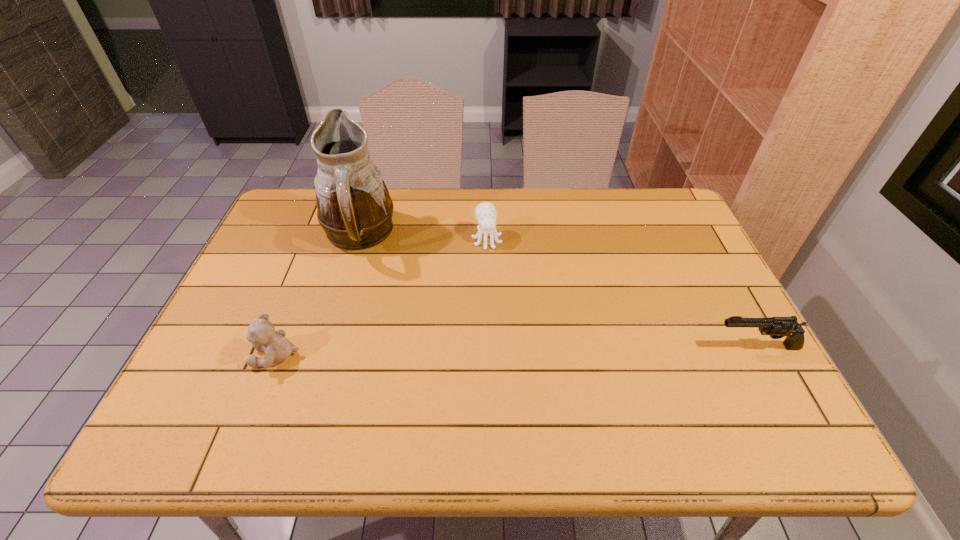
Where is `free space located 0.140m on the front-facing side of the octopus`? This screenshot has height=540, width=960. free space located 0.140m on the front-facing side of the octopus is located at coordinates coord(498,284).

The height and width of the screenshot is (540, 960). In order to click on vacant space situated on the front-facing side of the octopus in this screenshot , I will do `click(492, 262)`.

Find the location of a particular element. The height and width of the screenshot is (540, 960). free space located on the front-facing side of the octopus is located at coordinates (507, 317).

This screenshot has width=960, height=540. In order to click on free point located 0.240m from the spout of the tallest object in this screenshot , I will do `click(439, 296)`.

Where is `free space located from the spout of the tallest object`? The width and height of the screenshot is (960, 540). free space located from the spout of the tallest object is located at coordinates coord(436,295).

You are a GUI agent. You are given a task and a screenshot of the screen. Output one action in this format:
    pyautogui.click(x=<x>, y=<y>)
    Task: Click on the vacant area situated from the spout of the tallest object
    
    Given the screenshot: What is the action you would take?
    pyautogui.click(x=474, y=321)

I want to click on octopus that is positioned at the far edge, so click(x=485, y=212).

Identify the location of pitcher that is at the far edge. (354, 208).

You are a GUI agent. You are given a task and a screenshot of the screen. Output one action in this format:
    pyautogui.click(x=<x>, y=<y>)
    Task: Click on the object situated at the near edge
    The image size is (960, 540).
    Given the screenshot: What is the action you would take?
    pyautogui.click(x=262, y=334)

Find the location of a particular element. object at the left edge is located at coordinates (262, 334).